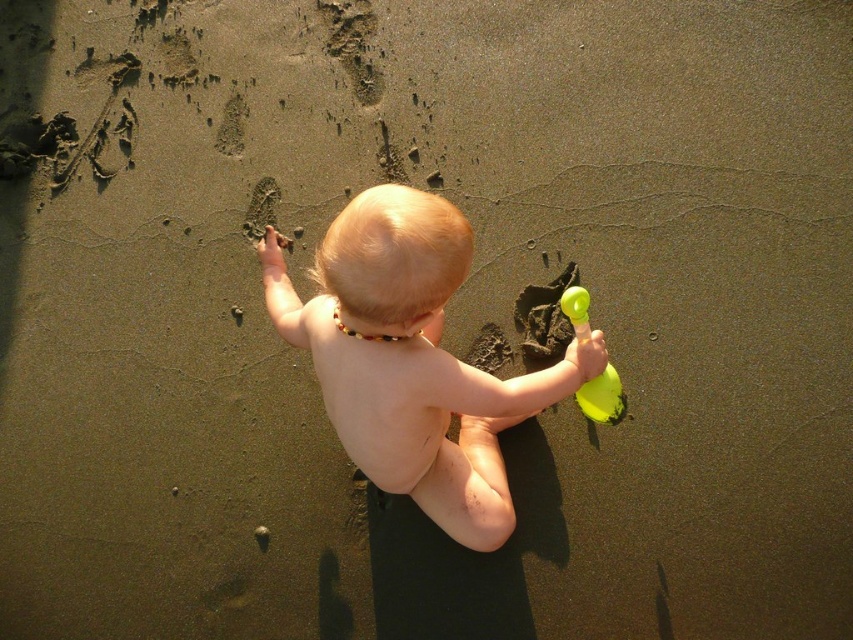
Question: Which of the following is the farthest from the observer?

Choices:
 (A) green rubber toy at right
 (B) smooth skin baby at center

Answer: (A)

Question: Does smooth skin baby at center come in front of green rubber toy at right?

Choices:
 (A) yes
 (B) no

Answer: (A)

Question: Is smooth skin baby at center below green rubber toy at right?

Choices:
 (A) no
 (B) yes

Answer: (A)

Question: Which point is farther to the camera?

Choices:
 (A) smooth skin baby at center
 (B) green rubber toy at right

Answer: (B)

Question: Can you confirm if smooth skin baby at center is bigger than green rubber toy at right?

Choices:
 (A) yes
 (B) no

Answer: (A)